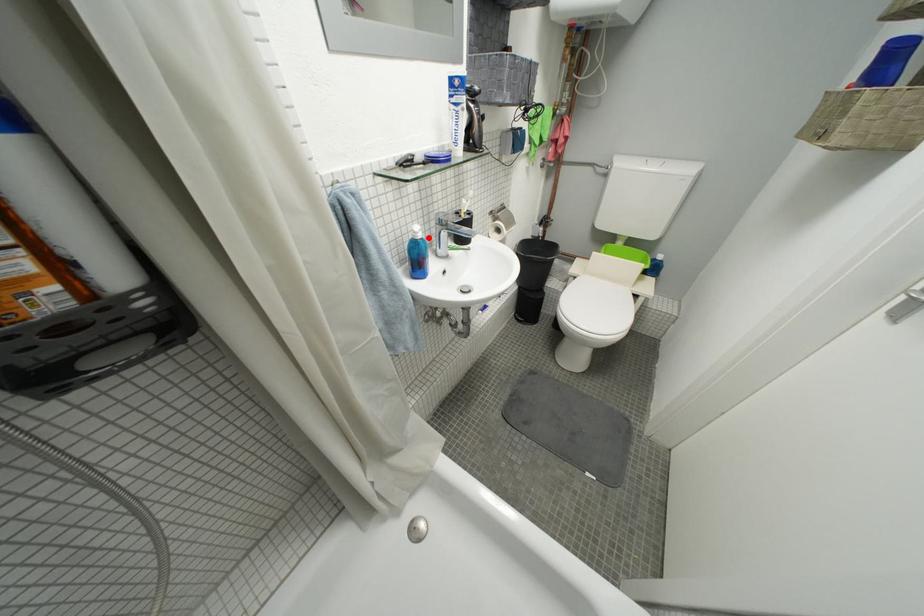
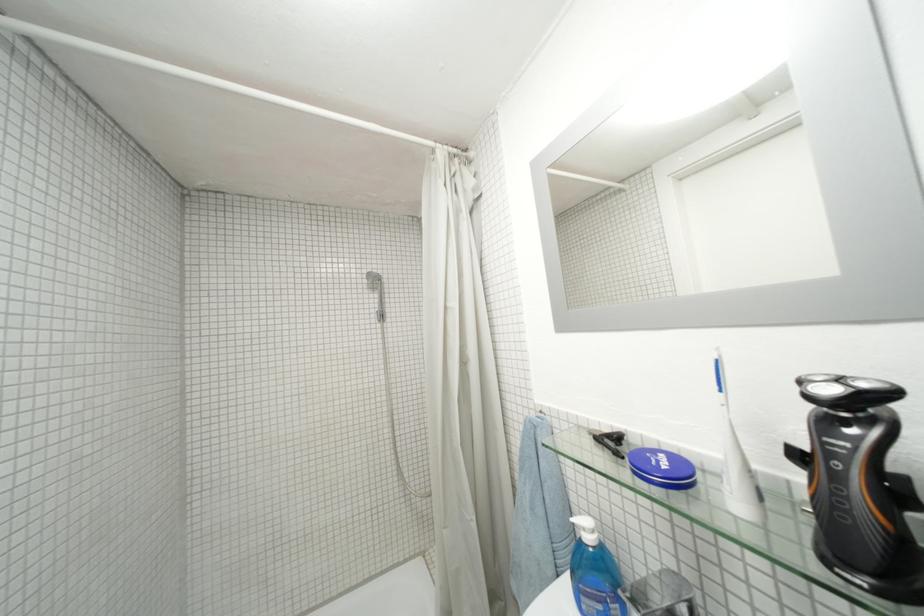
In the second image, find the point that corresponds to the highlighted location in the first image.

(598, 541)